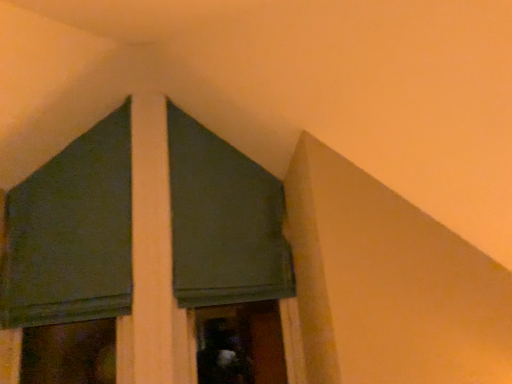
Identify the location of green matte window at upper center. (72, 233).

The width and height of the screenshot is (512, 384). What do you see at coordinates (72, 233) in the screenshot?
I see `green matte window at upper center` at bounding box center [72, 233].

Identify the location of green matte window at upper center. (72, 233).